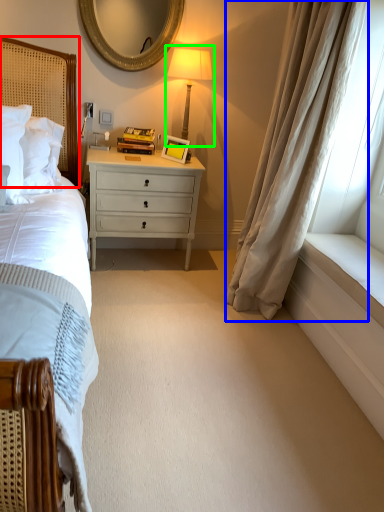
Question: Considering the real-world distances, which object is closest to headboard (highlighted by a red box)? curtain (highlighted by a blue box) or bedside lamp (highlighted by a green box).

Choices:
 (A) curtain
 (B) bedside lamp

Answer: (B)